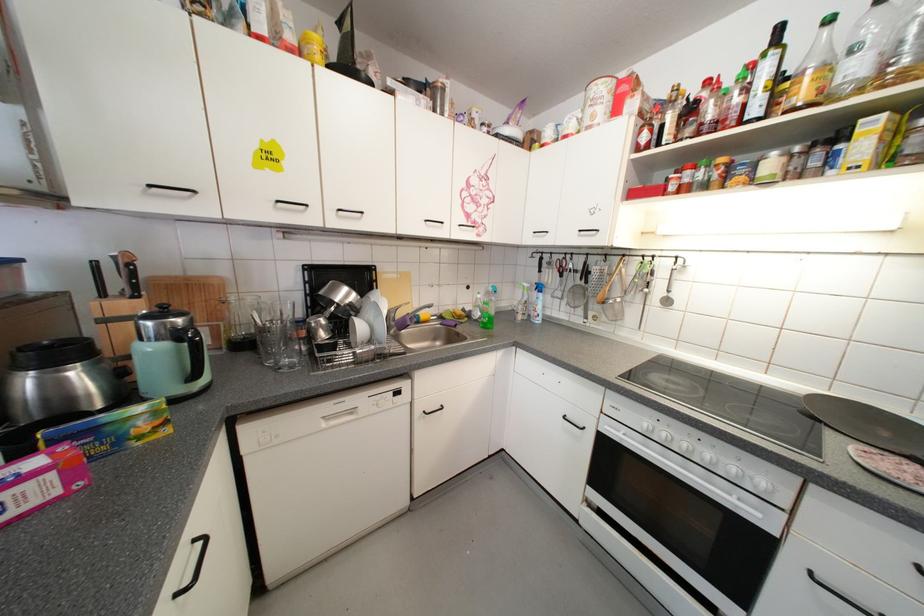
Find where to lift the small spice jar. Please return your answer as a coordinate pair (x, y).

(672, 182)